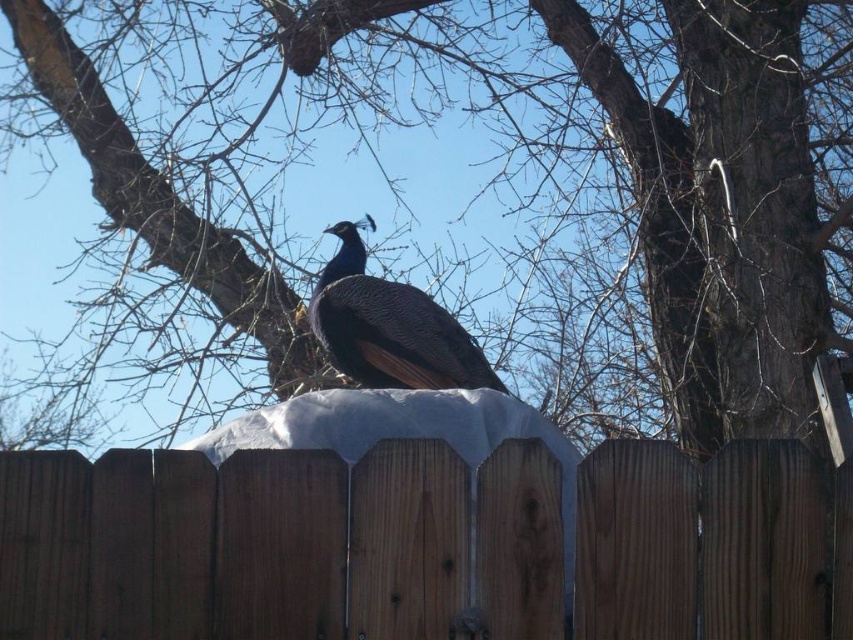
Question: Can you confirm if brown wood tree at upper center is smaller than brown wooden fence at center?

Choices:
 (A) yes
 (B) no

Answer: (B)

Question: Which of the following is the closest to the observer?

Choices:
 (A) (674, 321)
 (B) (376, 352)

Answer: (B)

Question: In this image, where is brown wood tree at upper center located relative to brown wooden fence at center?

Choices:
 (A) above
 (B) below

Answer: (A)

Question: Is brown wooden fence at center positioned behind shiny blue peacock at center?

Choices:
 (A) no
 (B) yes

Answer: (A)

Question: Which point is closer to the camera?

Choices:
 (A) (779, 83)
 (B) (376, 316)
 (C) (589, 516)

Answer: (C)

Question: Based on their relative distances, which object is nearer to the brown wooden fence at center?

Choices:
 (A) brown wood tree at upper center
 (B) shiny blue peacock at center

Answer: (B)